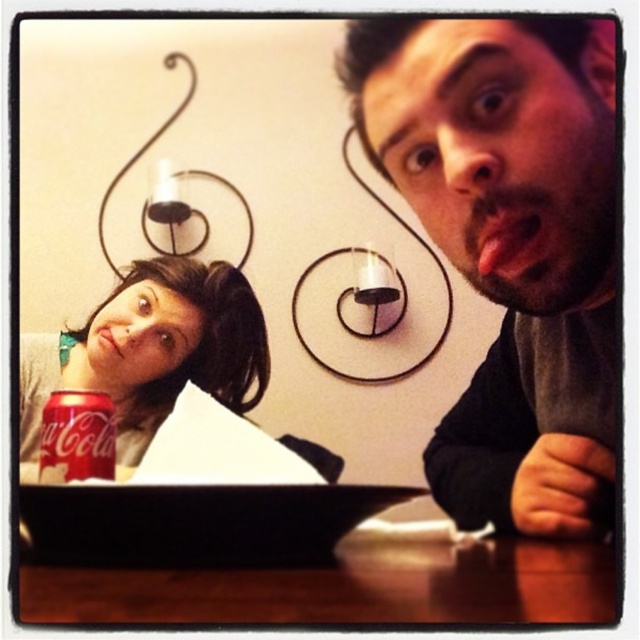
You are standing in front of the scene described. If you want to place a small vase on the wooden table at lower center, where exactly should you place it according to the coordinates provided?

The wooden table at lower center is located at coordinates point (344,588), so place the vase there.

You are standing in front of the table where the two people are sitting. You want to place a small snack exactly at point (381, 554). The snack needs to be within 15 inches from your current position. Can you place it there?

The distance between point (381, 554) and the camera is 18.97 inches, which is more than 15 inches. Therefore, you cannot place the snack there as it exceeds the required distance.